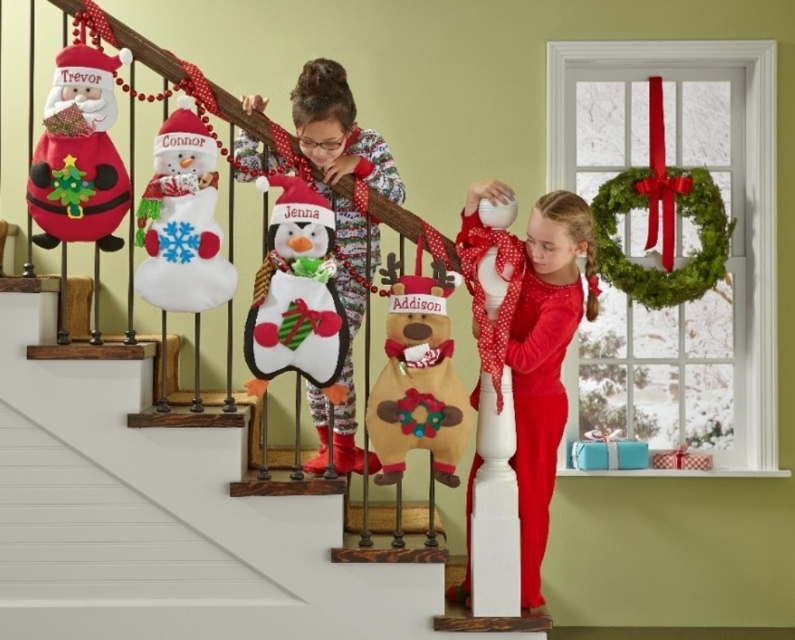
Question: Among these points, which one is nearest to the camera?

Choices:
 (A) (165, 154)
 (B) (287, 262)
 (C) (37, 509)

Answer: (A)

Question: Considering the real-world distances, which object is closest to the felt reindeer stocking at center?

Choices:
 (A) fuzzy white penguin at center
 (B) felt snowman at upper center

Answer: (B)

Question: Does fuzzy white penguin at center have a greater width compared to felt snowman at upper left?

Choices:
 (A) no
 (B) yes

Answer: (B)

Question: Which object is closer to the camera taking this photo?

Choices:
 (A) felt snowman at upper center
 (B) red velvet dress at center
 (C) felt reindeer stocking at center
 (D) felt snowman at upper left

Answer: (A)

Question: Is felt reindeer stocking at center above felt snowman at upper left?

Choices:
 (A) no
 (B) yes

Answer: (A)

Question: In this image, where is felt reindeer stocking at center located relative to felt penguin at center?

Choices:
 (A) left
 (B) right

Answer: (A)